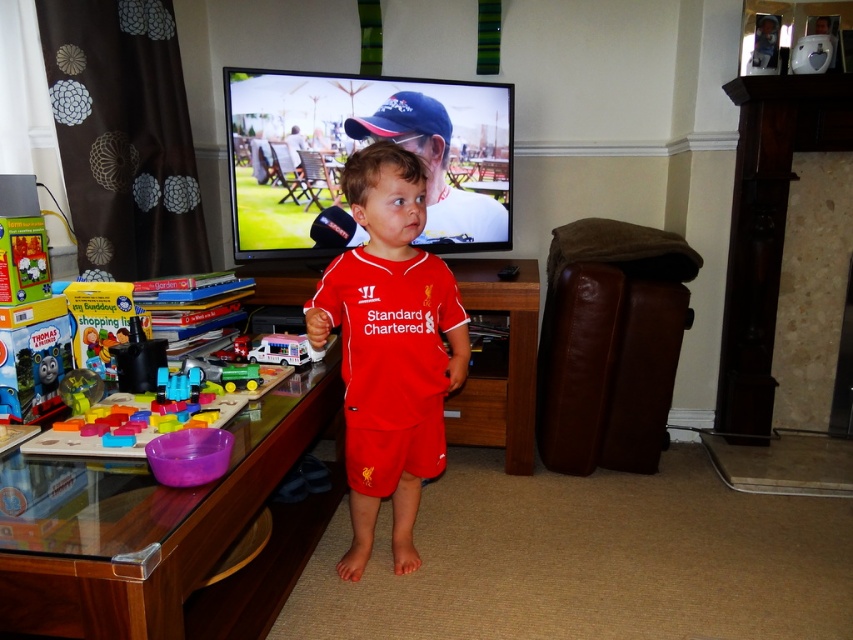
Question: Does matte red jersey at center have a larger size compared to blue fabric baseball cap at upper center?

Choices:
 (A) no
 (B) yes

Answer: (B)

Question: Which of the following is the farthest from the observer?

Choices:
 (A) blue fabric baseball cap at upper center
 (B) white plastic toy truck at center
 (C) matte red jersey at center

Answer: (A)

Question: Does blue fabric baseball cap at upper center appear over white plastic toy truck at center?

Choices:
 (A) yes
 (B) no

Answer: (A)

Question: Can you confirm if blue fabric baseball cap at upper center is positioned above white plastic toy truck at center?

Choices:
 (A) yes
 (B) no

Answer: (A)

Question: Which point is closer to the camera?

Choices:
 (A) blue fabric baseball cap at upper center
 (B) matte red jersey at center
 (C) white plastic toy truck at center

Answer: (B)

Question: Which of the following is the farthest from the observer?

Choices:
 (A) (405, 474)
 (B) (310, 356)
 (C) (358, 131)

Answer: (C)